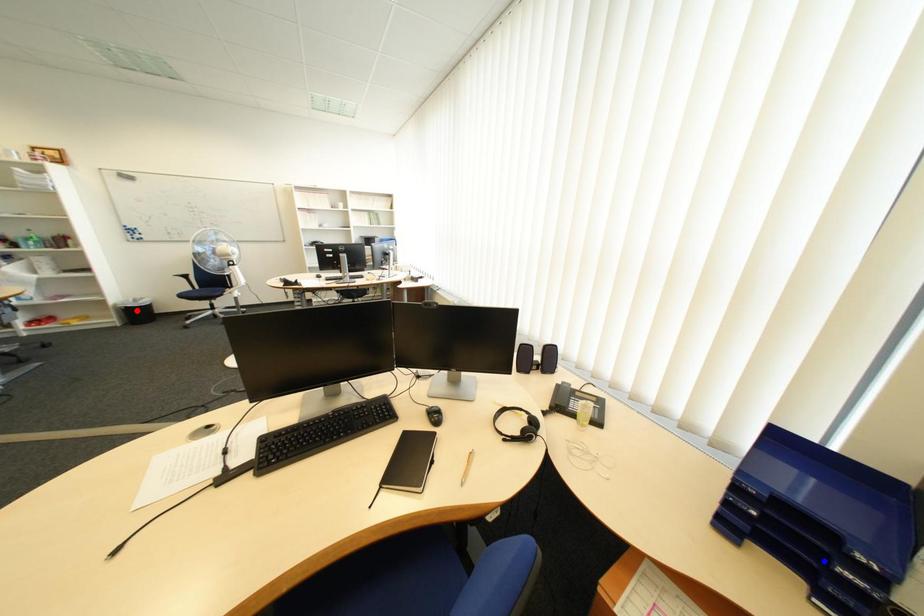
Question: Which of the two points in the image is closer to the camera?

Choices:
 (A) Blue point is closer.
 (B) Red point is closer.

Answer: (A)